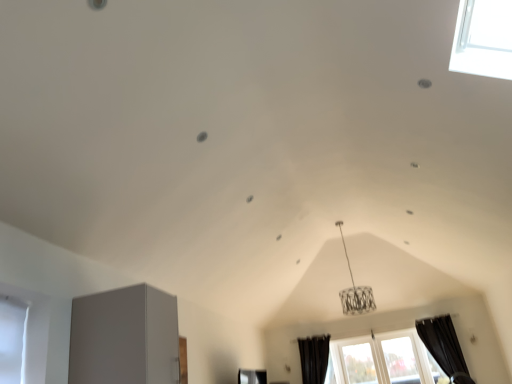
Question: Can you confirm if white glass window at lower right, which is counted as the second window, starting from the right, is smaller than transparent glass window at lower right, the second window viewed from the left?

Choices:
 (A) yes
 (B) no

Answer: (B)

Question: From a real-world perspective, is white glass window at lower right, which is the first window from left to right, positioned over transparent glass window at lower right, the second window viewed from the left, based on gravity?

Choices:
 (A) yes
 (B) no

Answer: (B)

Question: Considering the relative positions of white glass window at lower right, which is the first window from left to right, and transparent glass window at lower right, acting as the first window starting from the right, in the image provided, is white glass window at lower right, which is the first window from left to right, to the left of transparent glass window at lower right, acting as the first window starting from the right, from the viewer's perspective?

Choices:
 (A) yes
 (B) no

Answer: (A)

Question: Considering the relative sizes of white glass window at lower right, which is the first window from left to right, and transparent glass window at lower right, the second window viewed from the left, in the image provided, is white glass window at lower right, which is the first window from left to right, thinner than transparent glass window at lower right, the second window viewed from the left,?

Choices:
 (A) no
 (B) yes

Answer: (B)

Question: Is white glass window at lower right, which is counted as the second window, starting from the right, completely or partially outside of transparent glass window at lower right, the second window viewed from the left?

Choices:
 (A) no
 (B) yes

Answer: (B)

Question: Based on their sizes in the image, would you say black fabric curtain at lower right, the 2th curtain positioned from the left, is bigger or smaller than white glass window at lower right, which is counted as the second window, starting from the right?

Choices:
 (A) small
 (B) big

Answer: (B)

Question: From the image's perspective, is black fabric curtain at lower right, the 1th curtain from the right, positioned above or below white glass window at lower right, which is the first window from left to right?

Choices:
 (A) below
 (B) above

Answer: (B)

Question: Looking at their shapes, would you say black fabric curtain at lower right, the 2th curtain positioned from the left, is wider or thinner than white glass window at lower right, which is the first window from left to right?

Choices:
 (A) thin
 (B) wide

Answer: (B)

Question: From a real-world perspective, relative to white glass window at lower right, which is counted as the second window, starting from the right, is black fabric curtain at lower right, the 2th curtain positioned from the left, vertically above or below?

Choices:
 (A) above
 (B) below

Answer: (A)

Question: Would you say transparent glass window at lower right, the second window viewed from the left, is inside or outside black fabric curtain at lower center, the 1th curtain when ordered from left to right?

Choices:
 (A) inside
 (B) outside

Answer: (B)

Question: Considering the relative positions of transparent glass window at lower right, the second window viewed from the left, and black fabric curtain at lower center, the 1th curtain when ordered from left to right, in the image provided, is transparent glass window at lower right, the second window viewed from the left, to the left or to the right of black fabric curtain at lower center, the 1th curtain when ordered from left to right,?

Choices:
 (A) right
 (B) left

Answer: (A)

Question: From a real-world perspective, relative to black fabric curtain at lower center, the 1th curtain when ordered from left to right, is transparent glass window at lower right, acting as the first window starting from the right, vertically above or below?

Choices:
 (A) above
 (B) below

Answer: (B)

Question: From the image's perspective, is transparent glass window at lower right, acting as the first window starting from the right, above or below black fabric curtain at lower center, placed as the 2th curtain when sorted from right to left?

Choices:
 (A) above
 (B) below

Answer: (A)

Question: Considering the positions of transparent glass window at lower right, acting as the first window starting from the right, and white glass window at lower right, which is the first window from left to right, in the image, is transparent glass window at lower right, acting as the first window starting from the right, wider or thinner than white glass window at lower right, which is the first window from left to right,?

Choices:
 (A) thin
 (B) wide

Answer: (B)

Question: Considering the positions of transparent glass window at lower right, the second window viewed from the left, and white glass window at lower right, which is counted as the second window, starting from the right, in the image, is transparent glass window at lower right, the second window viewed from the left, taller or shorter than white glass window at lower right, which is counted as the second window, starting from the right,?

Choices:
 (A) tall
 (B) short

Answer: (A)